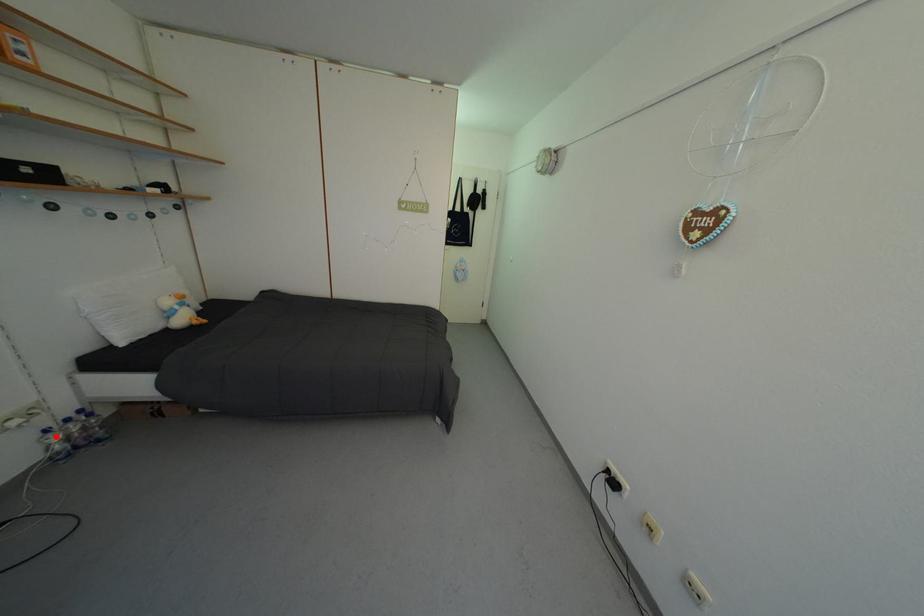
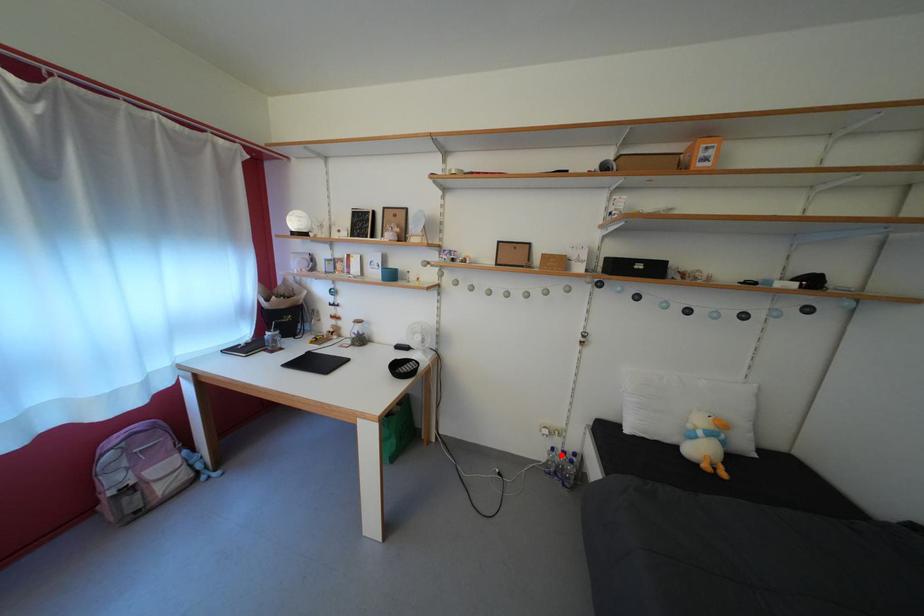
I am providing you with two images of the same scene from different viewpoints. A red point is marked on the first image and another point is marked on the second image. Does the point marked in image1 correspond to the same location as the one in image2?

Yes